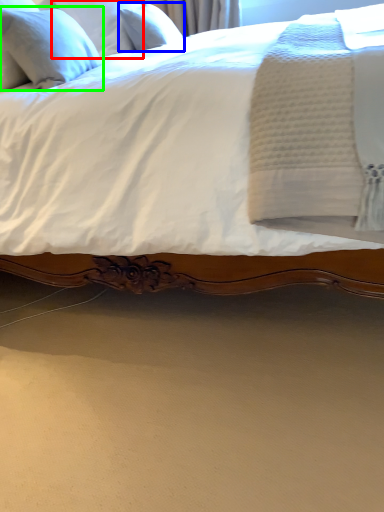
Question: Which object is positioned farthest from pillow (highlighted by a red box)? Select from pillow (highlighted by a blue box) and pillow (highlighted by a green box).

Choices:
 (A) pillow
 (B) pillow

Answer: (B)